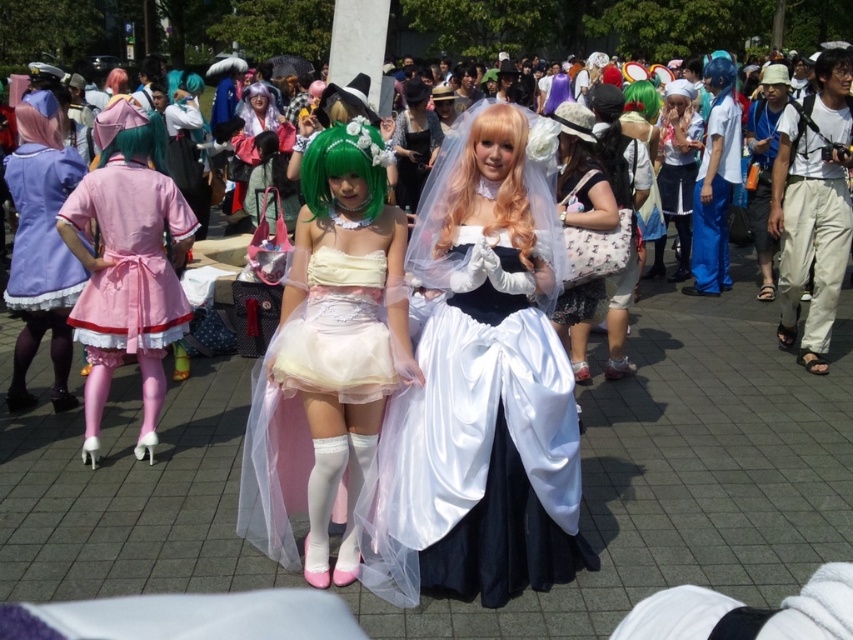
Does satin white dress at center have a larger size compared to pink satin dress at left?

Indeed, satin white dress at center has a larger size compared to pink satin dress at left.

Between satin white dress at center and pink satin dress at left, which one is positioned lower?

Positioned lower is satin white dress at center.

The image size is (853, 640). What are the coordinates of `satin white dress at center` in the screenshot? It's located at (482, 385).

Does pink satin dress at left appear on the left side of green matte wig at center?

Correct, you'll find pink satin dress at left to the left of green matte wig at center.

Between point (125, 305) and point (311, 196), which one is positioned behind?

Positioned behind is point (125, 305).

Locate an element on the screen. Image resolution: width=853 pixels, height=640 pixels. pink satin dress at left is located at coordinates (126, 268).

Is satin white dress at center positioned before white fabric purse at center?

Yes.

Can you confirm if satin white dress at center is thinner than white fabric purse at center?

In fact, satin white dress at center might be wider than white fabric purse at center.

Does point (541, 333) come closer to viewer compared to point (567, 308)?

Yes.

Image resolution: width=853 pixels, height=640 pixels. In order to click on satin white dress at center in this screenshot , I will do 482,385.